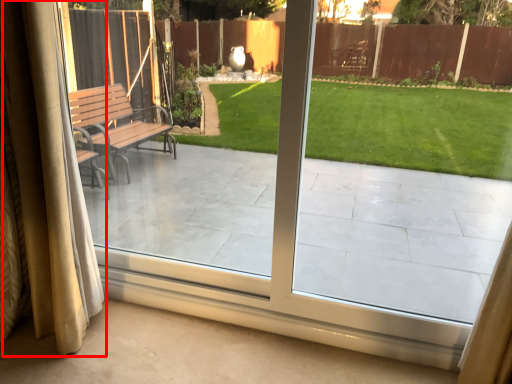
Question: From the image's perspective, what is the correct spatial relationship of curtain (annotated by the red box) in relation to porch?

Choices:
 (A) below
 (B) above

Answer: (A)